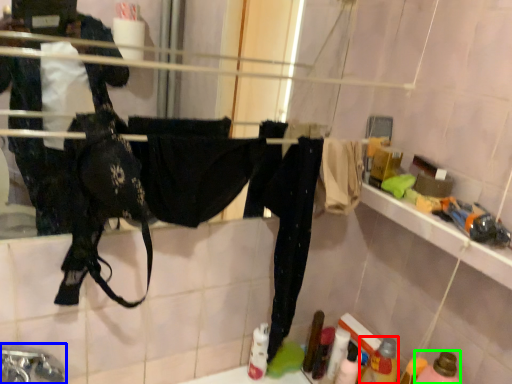
Question: Which object is the closest to the bottle (highlighted by a red box)? Choose among these: faucet (highlighted by a blue box) or bottle (highlighted by a green box).

Choices:
 (A) faucet
 (B) bottle

Answer: (B)